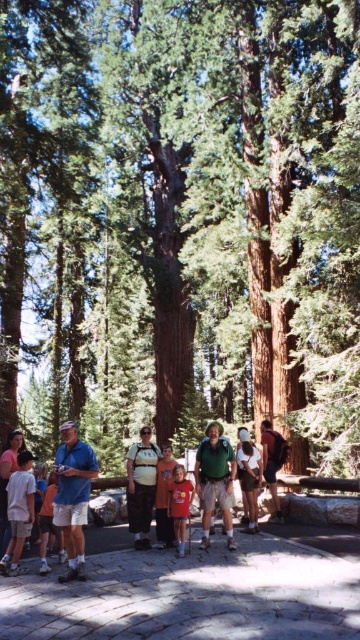
Question: Which of the following is the closest to the observer?

Choices:
 (A) (162, 454)
 (B) (12, 532)
 (C) (60, 492)

Answer: (B)

Question: Which object appears farthest from the camera in this image?

Choices:
 (A) green matte shirt at center
 (B) camouflage pants at center

Answer: (B)

Question: Can you confirm if white cotton shirt at center is positioned below orange t-shirt at center?

Choices:
 (A) no
 (B) yes

Answer: (A)

Question: Can you confirm if red cotton shirt at center is thinner than dark brown leather backpack at center?

Choices:
 (A) yes
 (B) no

Answer: (A)

Question: Among these objects, which one is nearest to the camera?

Choices:
 (A) light blue shirt at lower left
 (B) camouflage pants at center
 (C) red cotton shirt at center

Answer: (A)

Question: Is red cotton shirt at center wider than dark brown leather backpack at center?

Choices:
 (A) no
 (B) yes

Answer: (A)